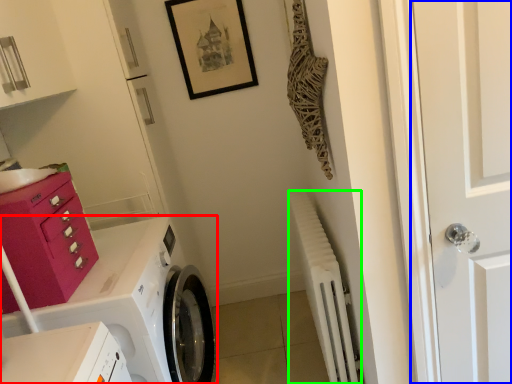
Question: Considering the real-world distances, which object is farthest from washing machine (highlighted by a red box)? door (highlighted by a blue box) or radiator (highlighted by a green box)?

Choices:
 (A) door
 (B) radiator

Answer: (A)